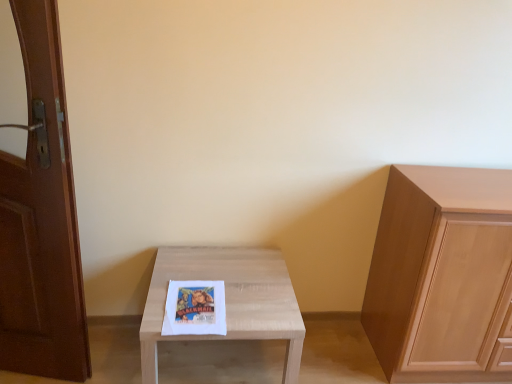
At what (x,y) coordinates should I click in order to perform the action: click on vacant space underneath light wood table at center (from a real-world perspective). Please return your answer as a coordinate pair (x, y). The width and height of the screenshot is (512, 384). Looking at the image, I should click on (220, 360).